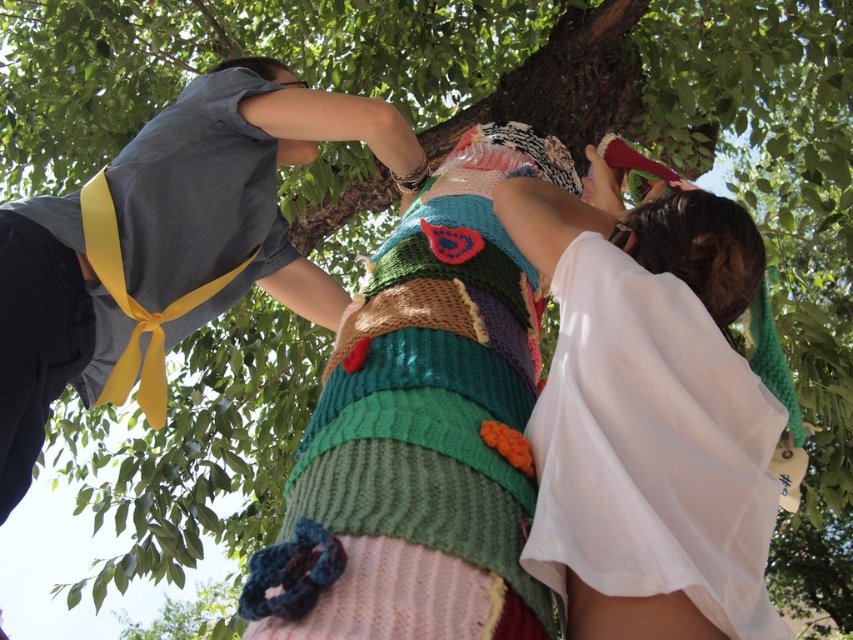
Which of these two, knitted fabric at center or white sheer fabric dress at lower right, stands taller?

knitted fabric at center

This screenshot has width=853, height=640. What do you see at coordinates (427, 412) in the screenshot?
I see `knitted fabric at center` at bounding box center [427, 412].

What do you see at coordinates (427, 412) in the screenshot? This screenshot has width=853, height=640. I see `knitted fabric at center` at bounding box center [427, 412].

Locate an element on the screen. knitted fabric at center is located at coordinates (427, 412).